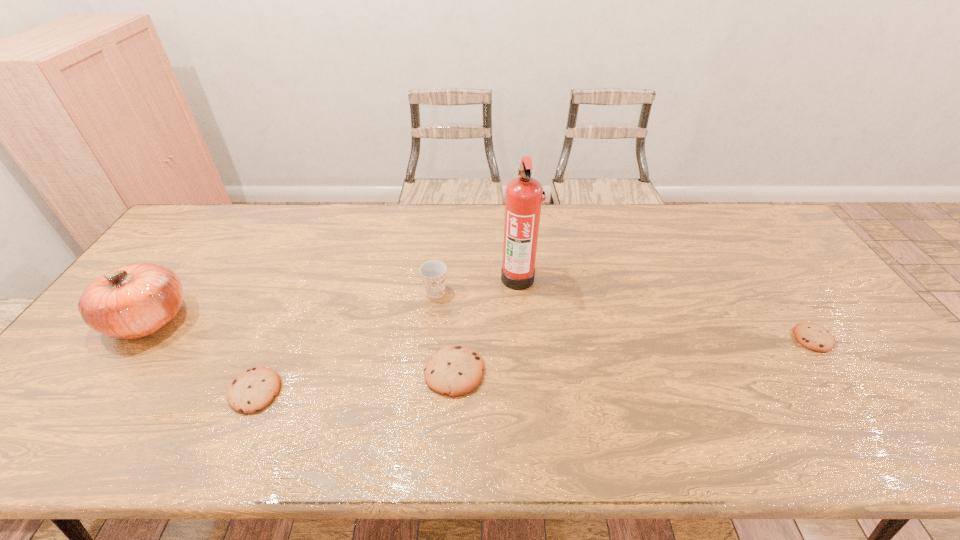
At what (x,y) coordinates should I click in order to perform the action: click on free space that satisfies the following two spatial constraints: 1. on the back side of the pumpkin; 2. on the left side of the third tallest object. Please return your answer as a coordinate pair (x, y). Looking at the image, I should click on tap(168, 292).

Find the location of a particular element. The width and height of the screenshot is (960, 540). free space that satisfies the following two spatial constraints: 1. with the nozzle pointing from the back of the fifth object from left to right; 2. on the front side of the fourth shortest object is located at coordinates (519, 292).

I want to click on vacant space that satisfies the following two spatial constraints: 1. on the back side of the Dixie cup; 2. on the left side of the fifth shortest object, so click(x=168, y=292).

Locate an element on the screen. free location that satisfies the following two spatial constraints: 1. with the nozzle pointing from the back of the tallest object; 2. on the front side of the Dixie cup is located at coordinates (519, 292).